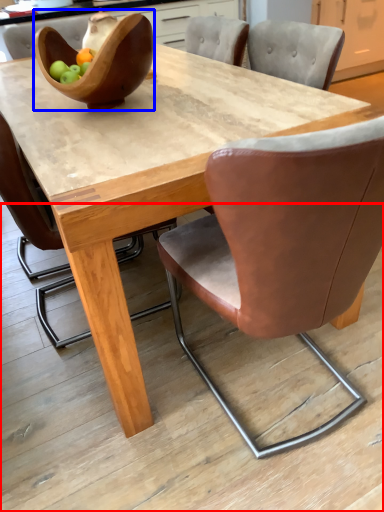
Question: Among these objects, which one is nearest to the camera, concrete (highlighted by a red box) or bowl (highlighted by a blue box)?

Choices:
 (A) concrete
 (B) bowl

Answer: (A)